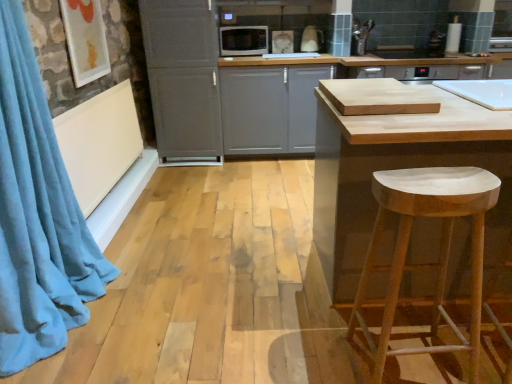
Question: Is blue velvet curtain at left thinner than white glossy toaster at upper center, placed as the 2th appliance when sorted from left to right?

Choices:
 (A) yes
 (B) no

Answer: (B)

Question: Does blue velvet curtain at left have a greater height compared to white glossy toaster at upper center, placed as the 2th appliance when sorted from left to right?

Choices:
 (A) no
 (B) yes

Answer: (B)

Question: Could you tell me if blue velvet curtain at left is turned towards white glossy toaster at upper center, which appears as the 1th appliance when viewed from the right?

Choices:
 (A) yes
 (B) no

Answer: (B)

Question: Does blue velvet curtain at left have a smaller size compared to white glossy toaster at upper center, which appears as the 1th appliance when viewed from the right?

Choices:
 (A) no
 (B) yes

Answer: (A)

Question: From a real-world perspective, is blue velvet curtain at left physically below white glossy toaster at upper center, which appears as the 1th appliance when viewed from the right?

Choices:
 (A) no
 (B) yes

Answer: (B)

Question: Is blue velvet curtain at left bigger than white glossy toaster at upper center, placed as the 2th appliance when sorted from left to right?

Choices:
 (A) no
 (B) yes

Answer: (B)

Question: Does natural wood cutting board at center appear on the left side of white glossy microwave at upper center, the first appliance from the left?

Choices:
 (A) no
 (B) yes

Answer: (A)

Question: From a real-world perspective, is natural wood cutting board at center located higher than white glossy microwave at upper center, the first appliance from the left?

Choices:
 (A) no
 (B) yes

Answer: (A)

Question: From the image's perspective, is natural wood cutting board at center over white glossy microwave at upper center, the first appliance from the left?

Choices:
 (A) no
 (B) yes

Answer: (A)

Question: From a real-world perspective, is natural wood cutting board at center located beneath white glossy microwave at upper center, the first appliance from the left?

Choices:
 (A) yes
 (B) no

Answer: (A)

Question: Is natural wood cutting board at center facing towards white glossy microwave at upper center, the first appliance from the left?

Choices:
 (A) yes
 (B) no

Answer: (B)

Question: Does natural wood cutting board at center have a greater height compared to white glossy microwave at upper center, the first appliance from the left?

Choices:
 (A) yes
 (B) no

Answer: (A)

Question: Does white matte cabinet at center, which is counted as the second cabinetry, starting from the left, appear on the left side of white glossy toaster at upper center, which appears as the 1th appliance when viewed from the right?

Choices:
 (A) yes
 (B) no

Answer: (A)